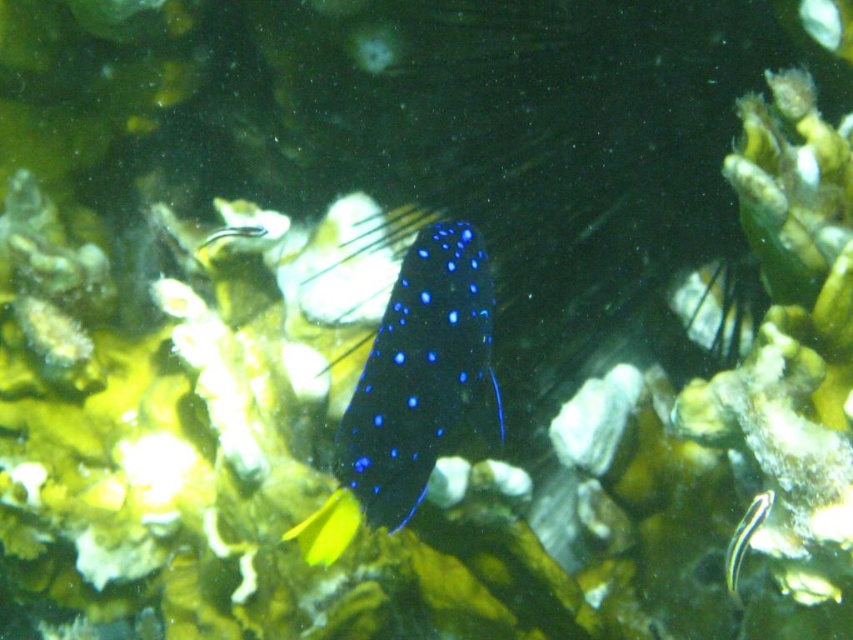
Question: Can you confirm if glossy blue fish at center is thinner than black glossy stripe at lower right?

Choices:
 (A) yes
 (B) no

Answer: (B)

Question: Among these points, which one is nearest to the camera?

Choices:
 (A) (344, 428)
 (B) (735, 541)

Answer: (A)

Question: Among these objects, which one is farthest from the camera?

Choices:
 (A) glossy blue fish at center
 (B) black glossy stripe at lower right

Answer: (B)

Question: Which of the following is the farthest from the observer?

Choices:
 (A) black glossy stripe at lower right
 (B) glossy blue fish at center

Answer: (A)

Question: Does glossy blue fish at center have a lesser width compared to black glossy stripe at lower right?

Choices:
 (A) no
 (B) yes

Answer: (A)

Question: Can you confirm if glossy blue fish at center is wider than black glossy stripe at lower right?

Choices:
 (A) yes
 (B) no

Answer: (A)